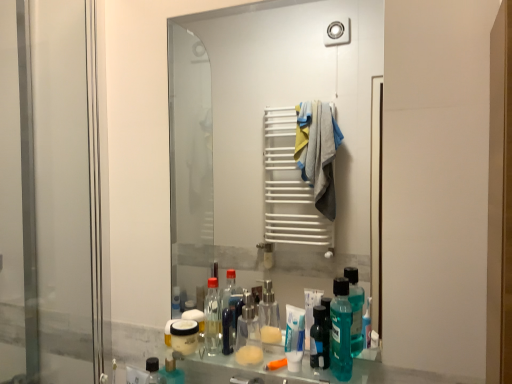
Question: Is transparent glass screen door at left taller or shorter than transparent plastic mouthwash at center?

Choices:
 (A) tall
 (B) short

Answer: (A)

Question: From a real-world perspective, is transparent glass screen door at left positioned above or below transparent plastic mouthwash at center?

Choices:
 (A) above
 (B) below

Answer: (A)

Question: Based on their relative distances, which object is farther from the clear glass mirror at center?

Choices:
 (A) teal plastic mouthwash at lower center
 (B) transparent glass screen door at left
 (C) transparent plastic mouthwash at center

Answer: (A)

Question: Estimate the real-world distances between objects in this image. Which object is farther from the transparent glass screen door at left?

Choices:
 (A) clear glass mirror at center
 (B) transparent plastic mouthwash at center
 (C) teal plastic mouthwash at lower center

Answer: (A)